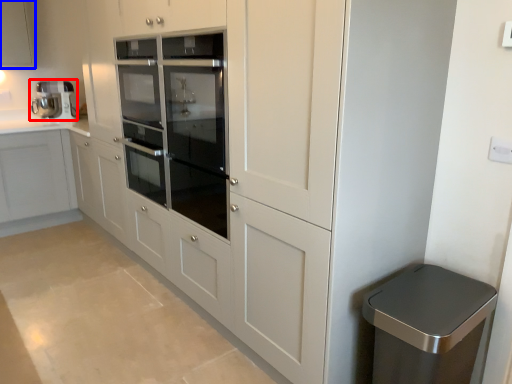
Question: Which of the following is the farthest to the observer, home appliance (highlighted by a red box) or cabinetry (highlighted by a blue box)?

Choices:
 (A) home appliance
 (B) cabinetry

Answer: (A)